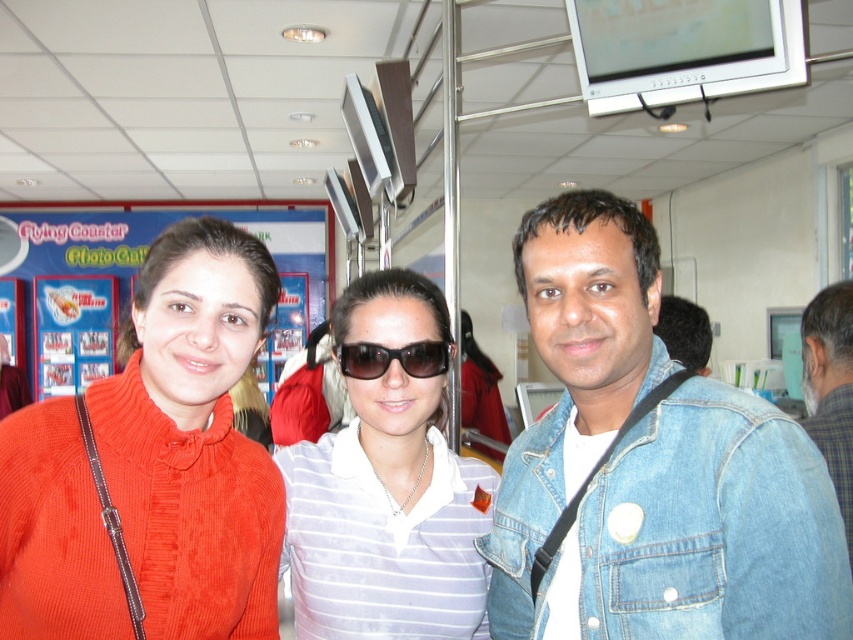
Question: Which point is closer to the camera taking this photo?

Choices:
 (A) (149, 444)
 (B) (833, 384)
 (C) (485, 595)
 (D) (634, 618)

Answer: (D)

Question: Which object is farther from the camera taking this photo?

Choices:
 (A) gray checkered shirt at right
 (B) matte red sweater at left

Answer: (A)

Question: Is matte red sweater at left above sunglasses at center?

Choices:
 (A) yes
 (B) no

Answer: (B)

Question: Does matte red sweater at left appear over sunglasses at center?

Choices:
 (A) yes
 (B) no

Answer: (B)

Question: Which of the following is the farthest from the observer?

Choices:
 (A) matte red sweater at left
 (B) gray checkered shirt at right
 (C) white striped shirt at center

Answer: (B)

Question: Does denim jacket at lower right have a greater width compared to sunglasses at center?

Choices:
 (A) yes
 (B) no

Answer: (A)